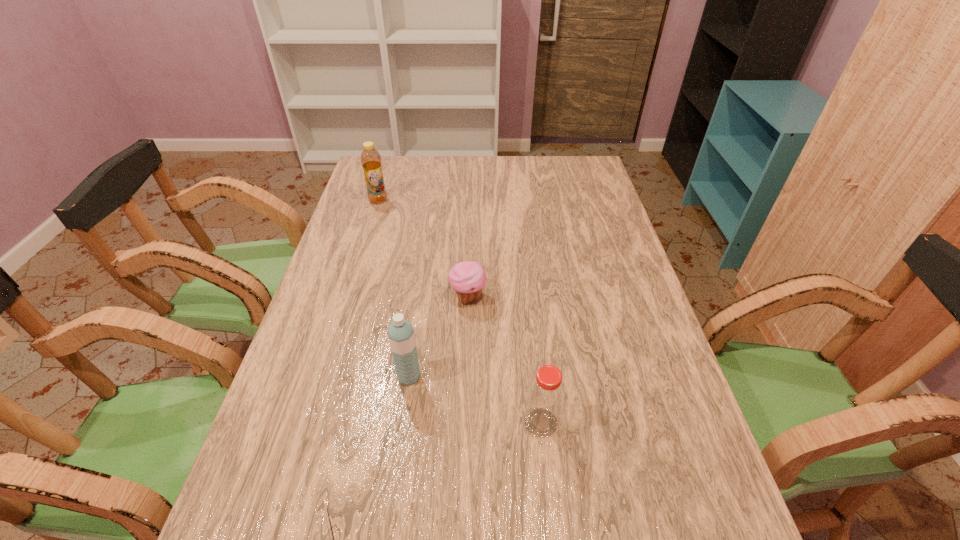
At what (x,y) coordinates should I click in order to perform the action: click on the taller bottle. Please return your answer as a coordinate pair (x, y). This screenshot has height=540, width=960. Looking at the image, I should click on (371, 162).

This screenshot has height=540, width=960. I want to click on the farthest object, so click(x=371, y=162).

The width and height of the screenshot is (960, 540). What are the coordinates of `the third object from right to left` in the screenshot? It's located at (401, 334).

At what (x,y) coordinates should I click in order to perform the action: click on water bottle. Please return your answer as a coordinate pair (x, y). This screenshot has height=540, width=960. Looking at the image, I should click on (401, 334).

Find the location of a particular element. the nearer bottle is located at coordinates (545, 397).

Locate an element on the screen. the right bottle is located at coordinates (545, 397).

Locate an element on the screen. the fourth object from left to right is located at coordinates (468, 278).

Image resolution: width=960 pixels, height=540 pixels. In order to click on cupcake in this screenshot , I will do (x=468, y=278).

The image size is (960, 540). Identify the location of free space located on the front of the farthest object. (361, 256).

Find the location of `vacant point located 0.050m on the front of the water bottle`. vacant point located 0.050m on the front of the water bottle is located at coordinates (404, 407).